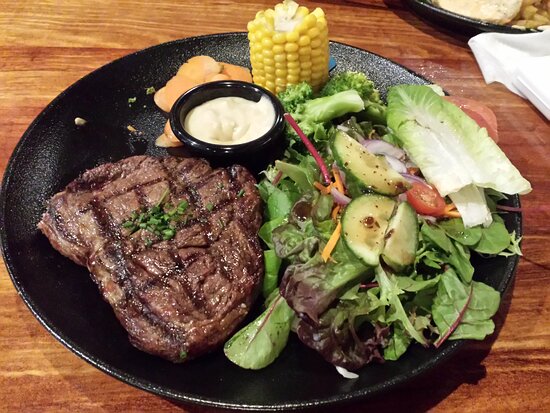
Locate an element on the screen. This screenshot has width=550, height=413. dish at the top right corner is located at coordinates (469, 13).